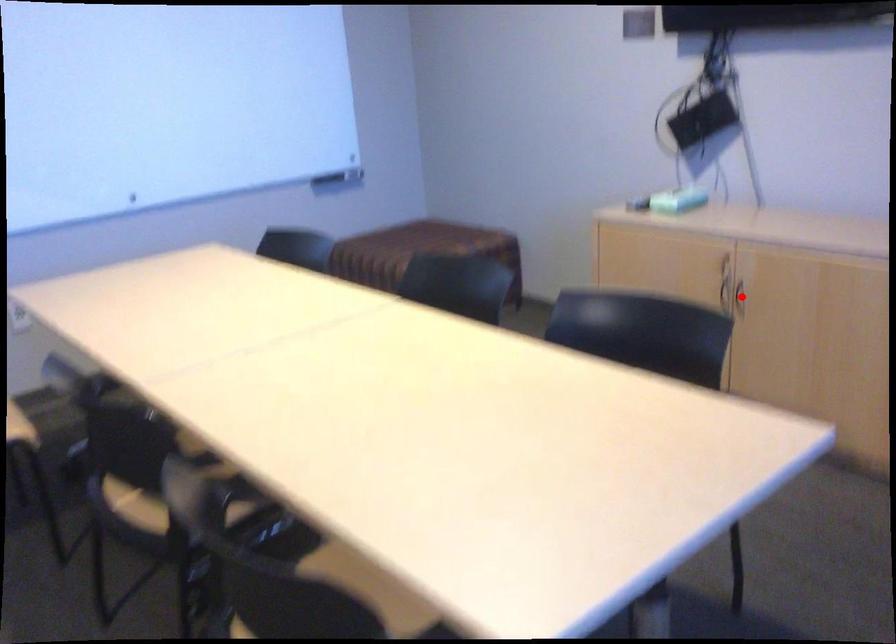
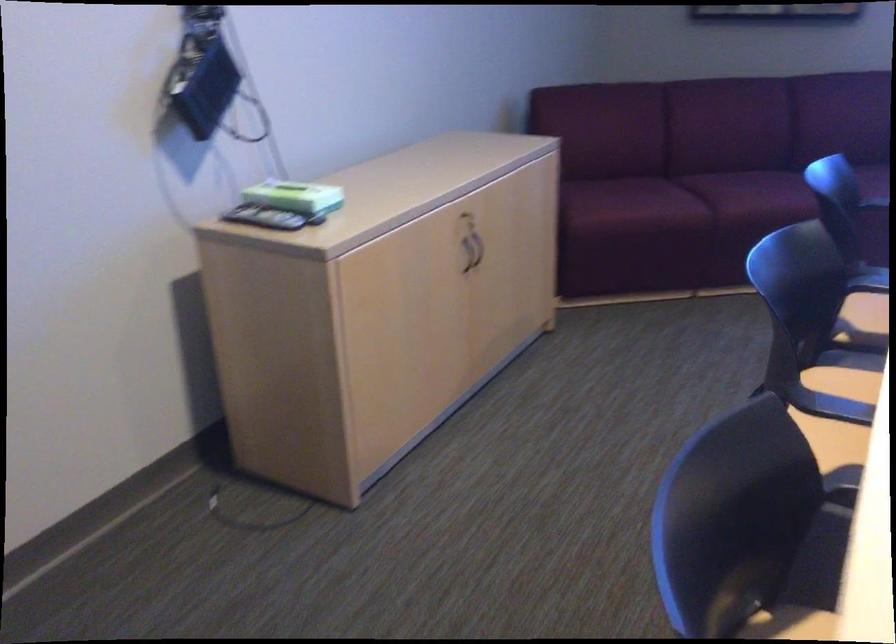
Question: I am providing you with two images of the same scene from different viewpoints. In image1, a red point is highlighted. Considering the same 3D point in image2, which of the following is correct?

Choices:
 (A) It is closer
 (B) It is farther

Answer: (A)